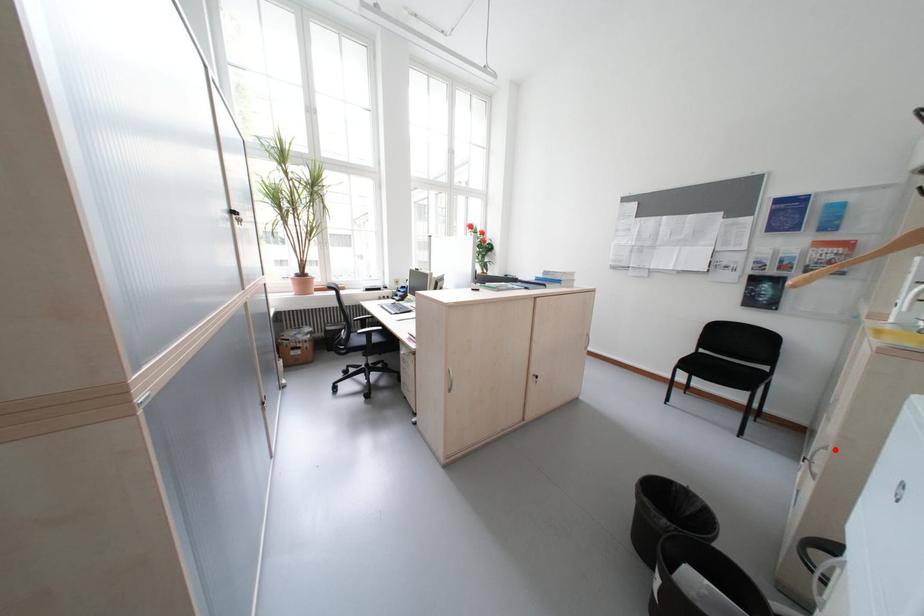
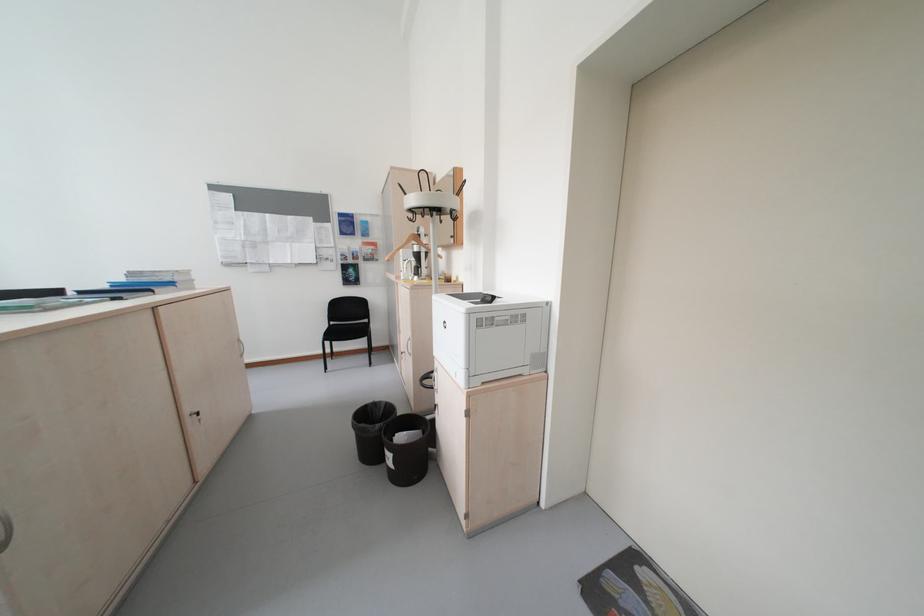
Question: A red point is marked in image1. In image2, is the corresponding 3D point closer to the camera or farther? Reply with the corresponding letter.

Choices:
 (A) The corresponding 3D point is closer.
 (B) The corresponding 3D point is farther.

Answer: (A)